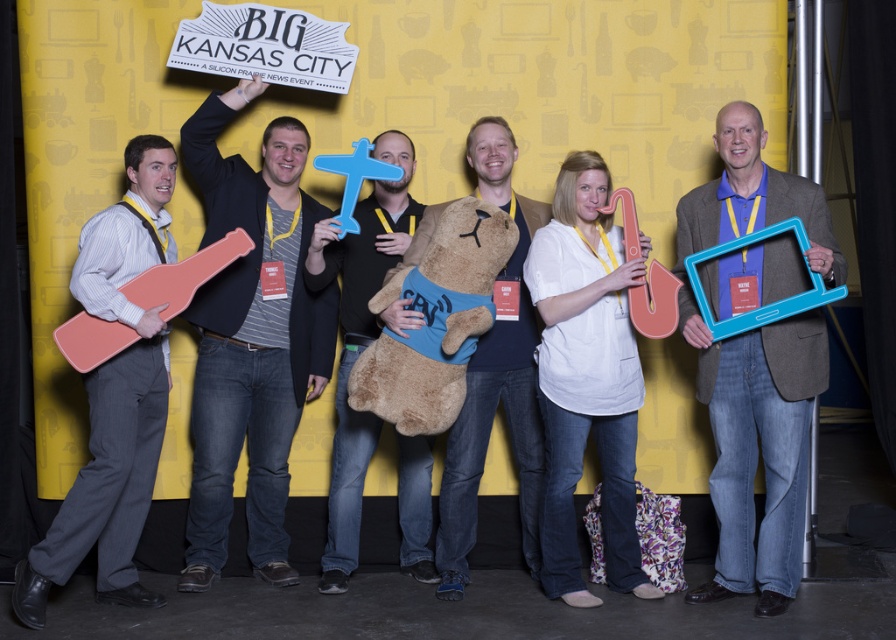
You are at the event and want to take a photo with the blue plastic frame at center and the soft plush teddy bear at center. If you stand facing the backdrop, which object should you place on your left to have both in the photo?

You should place the soft plush teddy bear at center on your left since the blue plastic frame at center is to the right of it, ensuring both are in the photo when positioned this way.

In the scene shown: You are organizing a photo shoot and need to place the blue plastic frame at center and the soft plush bear at center on a table. Given their sizes, which object should you place first to ensure stability?

The blue plastic frame at center should be placed first because it is larger and can provide a stable base for the soft plush bear at center.

You are at the event and need to place a small gift between the brushed wood guitar at left and the soft plush bear at center. Based on their positions, where should you position the gift?

The gift should be placed between the brushed wood guitar at left and the soft plush bear at center, as the guitar is to the left of the bear.